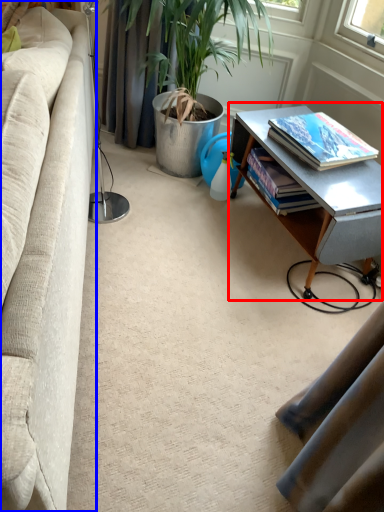
Question: Which object appears closest to the camera in this image, table (highlighted by a red box) or studio couch (highlighted by a blue box)?

Choices:
 (A) table
 (B) studio couch

Answer: (B)